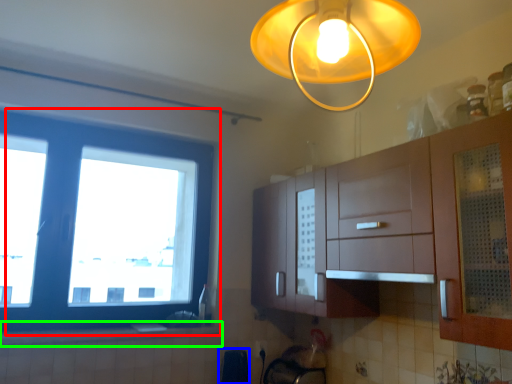
Question: Based on their relative distances, which object is farther from window (highlighted by a red box)? Choose from appliance (highlighted by a blue box) and counter top (highlighted by a green box).

Choices:
 (A) appliance
 (B) counter top

Answer: (A)